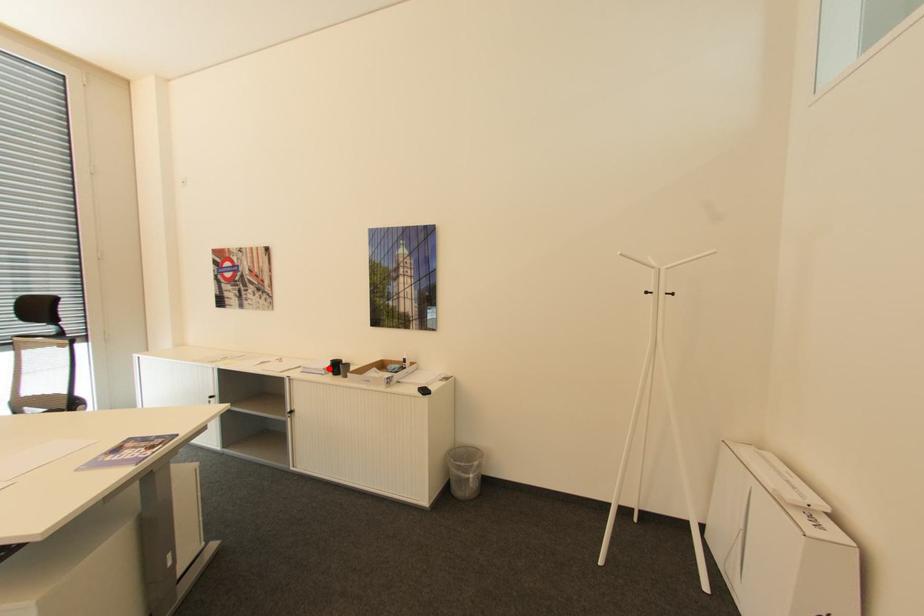
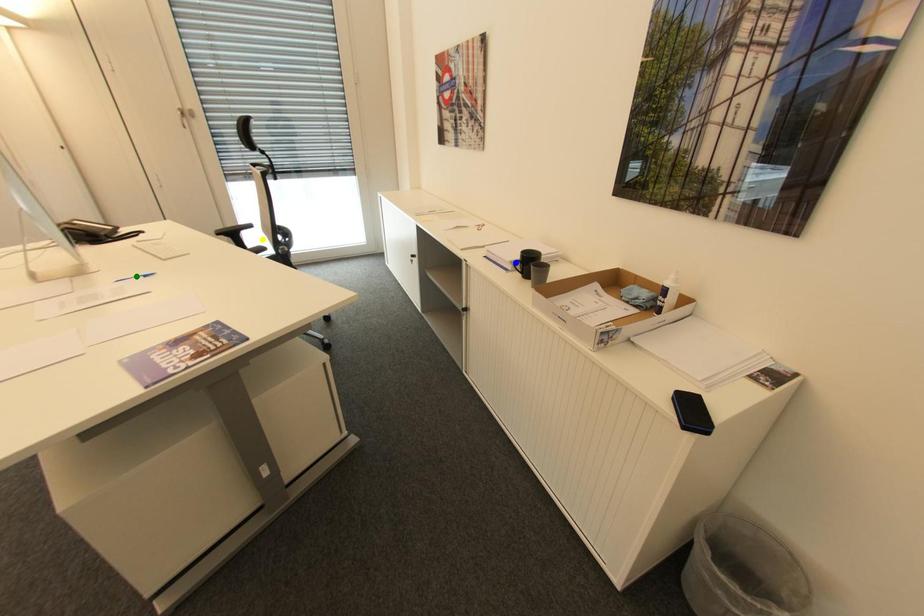
Question: I am providing you with two images of the same scene from different viewpoints. A red point is marked on the first image. You are given multiple points on the second image. In image 2, which mark is for the same physical point as the one in image 1?

Choices:
 (A) green point
 (B) blue point
 (C) yellow point

Answer: (B)